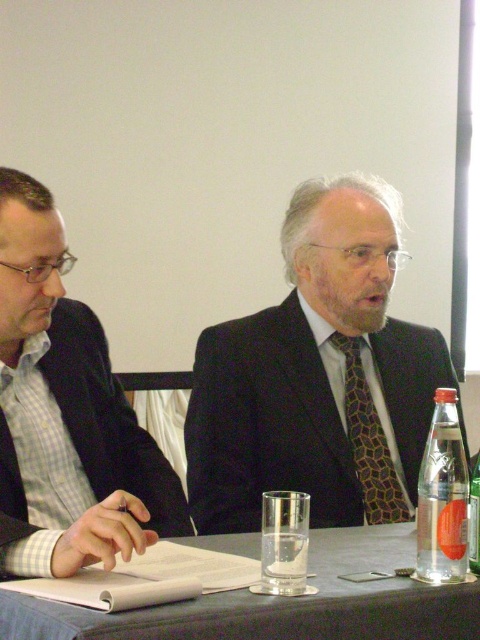
Question: Does clear plastic bottle at right have a lesser width compared to brown textured tie at center?

Choices:
 (A) no
 (B) yes

Answer: (B)

Question: Considering the real-world distances, which object is farthest from the dark gray suit at center?

Choices:
 (A) smooth gray table at center
 (B) clear glass bottle at right

Answer: (B)

Question: Which of the following is the closest to the observer?

Choices:
 (A) dark gray suit at center
 (B) smooth gray table at center
 (C) matte black jacket at left

Answer: (B)

Question: Which object appears closest to the camera in this image?

Choices:
 (A) matte black jacket at left
 (B) dark gray suit at center

Answer: (A)

Question: In this image, where is matte black jacket at left located relative to brown textured tie at center?

Choices:
 (A) below
 (B) above

Answer: (B)

Question: Does smooth gray table at center appear on the right side of brown textured tie at center?

Choices:
 (A) yes
 (B) no

Answer: (B)